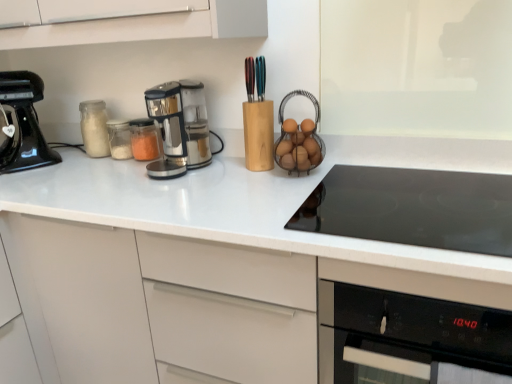
Question: In which direction should I rotate to look at sleek metallic coffee maker at center, arranged as the 2th kitchen appliance when viewed from the left?

Choices:
 (A) right
 (B) left

Answer: (B)

Question: Is white glossy countertop at center a part of black glass cooktop at center?

Choices:
 (A) yes
 (B) no

Answer: (B)

Question: Can you confirm if black glass cooktop at center is shorter than white glossy countertop at center?

Choices:
 (A) no
 (B) yes

Answer: (B)

Question: Is black glass cooktop at center not inside white glossy countertop at center?

Choices:
 (A) no
 (B) yes

Answer: (A)

Question: From the image's perspective, is black glass cooktop at center on top of white glossy countertop at center?

Choices:
 (A) yes
 (B) no

Answer: (A)

Question: Does black glass cooktop at center lie behind white glossy countertop at center?

Choices:
 (A) yes
 (B) no

Answer: (A)

Question: Is there a large distance between black glass cooktop at center and white glossy countertop at center?

Choices:
 (A) no
 (B) yes

Answer: (A)

Question: Considering the relative sizes of sleek metallic coffee maker at center, arranged as the 2th kitchen appliance when viewed from the left, and black glass cooktop at center in the image provided, is sleek metallic coffee maker at center, arranged as the 2th kitchen appliance when viewed from the left, taller than black glass cooktop at center?

Choices:
 (A) yes
 (B) no

Answer: (A)

Question: Considering the relative positions of sleek metallic coffee maker at center, the first kitchen appliance viewed from the right, and black glass cooktop at center in the image provided, is sleek metallic coffee maker at center, the first kitchen appliance viewed from the right, behind black glass cooktop at center?

Choices:
 (A) yes
 (B) no

Answer: (A)

Question: Is sleek metallic coffee maker at center, arranged as the 2th kitchen appliance when viewed from the left, not inside black glass cooktop at center?

Choices:
 (A) no
 (B) yes

Answer: (B)

Question: Does sleek metallic coffee maker at center, the first kitchen appliance viewed from the right, appear on the right side of black glass cooktop at center?

Choices:
 (A) yes
 (B) no

Answer: (B)

Question: From a real-world perspective, is sleek metallic coffee maker at center, the first kitchen appliance viewed from the right, below black glass cooktop at center?

Choices:
 (A) yes
 (B) no

Answer: (B)

Question: Considering the relative sizes of sleek metallic coffee maker at center, the first kitchen appliance viewed from the right, and black glass cooktop at center in the image provided, is sleek metallic coffee maker at center, the first kitchen appliance viewed from the right, wider than black glass cooktop at center?

Choices:
 (A) yes
 (B) no

Answer: (B)

Question: Could you tell me if translucent glass jar at left is turned towards black glass cooktop at center?

Choices:
 (A) yes
 (B) no

Answer: (B)